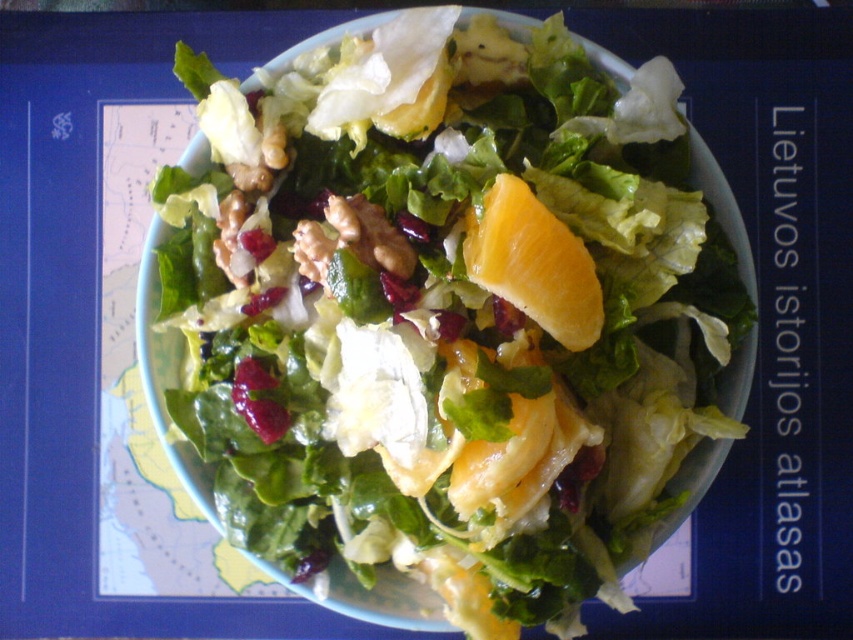
You are a chef preparing a salad and you want to arrange the green leafy salad at center and the orangesmoothfruit at center in a visually appealing way. Based on their current positions, which one is placed lower in the bowl?

The green leafy salad at center is placed lower in the bowl than the orangesmoothfruit at center, as it is positioned below it according to the description.

Looking at this image, you are a chef preparing a salad and you have a green leafy salad at center and an orangesmoothfruit at center in front of you. Which one has a greater width?

The green leafy salad at center has a greater width than the orangesmoothfruit at center according to the description provided.